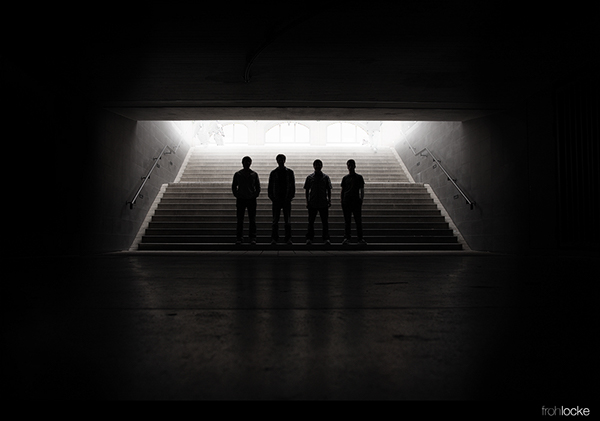
Where is `stairs`? Image resolution: width=600 pixels, height=421 pixels. stairs is located at coordinates (206, 199), (217, 160).